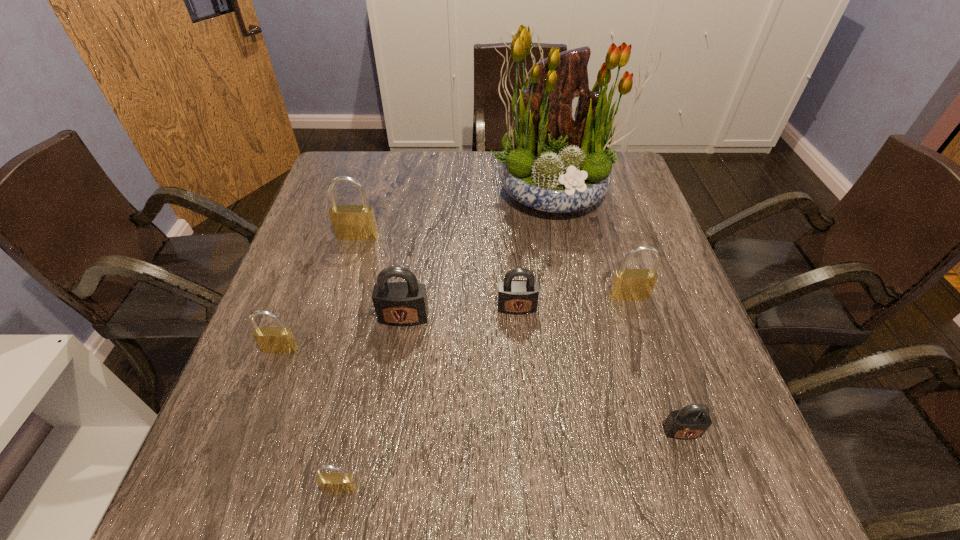
Identify the location of free space located 0.120m on the front-facing side of the leftmost object. The width and height of the screenshot is (960, 540). (258, 409).

This screenshot has width=960, height=540. In order to click on free space located 0.070m on the front of the seventh farthest object near the keyhole in this screenshot , I will do click(x=699, y=483).

This screenshot has height=540, width=960. Find the location of `object that is at the far edge`. object that is at the far edge is located at coordinates pos(555,162).

Identify the location of object that is at the near edge. (333, 483).

The width and height of the screenshot is (960, 540). Find the location of `flower arrangement that is positioned at the right edge`. flower arrangement that is positioned at the right edge is located at coordinates (555, 162).

This screenshot has width=960, height=540. What are the coordinates of `object situated at the far right corner` in the screenshot? It's located at (555, 162).

In the image, there is a desktop. Find the location of `free space at the far edge`. free space at the far edge is located at coordinates (388, 180).

The width and height of the screenshot is (960, 540). Identify the location of vacant space at the near edge. (325, 498).

This screenshot has width=960, height=540. I want to click on vacant space at the left edge, so click(312, 241).

Locate an element on the screen. The width and height of the screenshot is (960, 540). free region at the right edge is located at coordinates (632, 353).